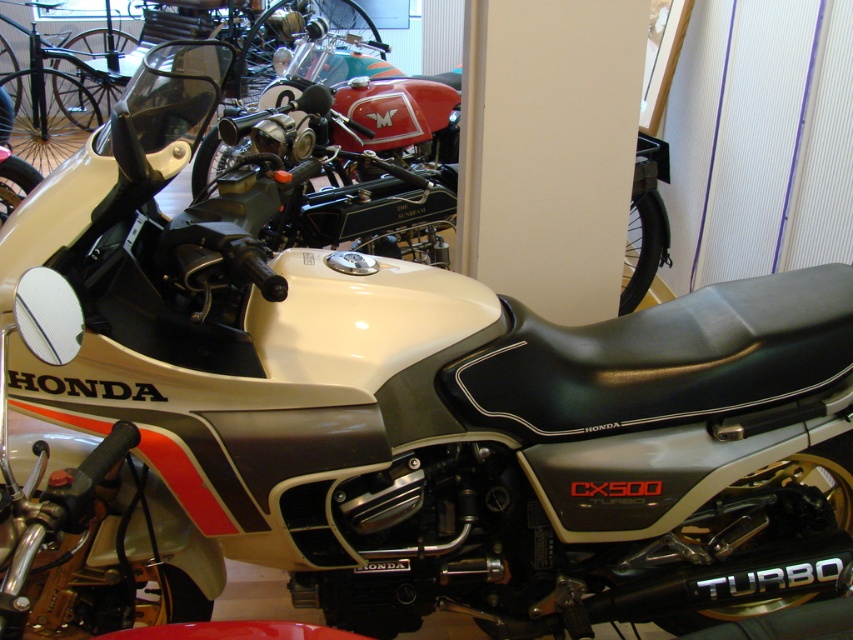
Does point (561, 177) come farther from viewer compared to point (407, 212)?

No, it is in front of (407, 212).

Who is lower down, white matte pillar at center or matte black motorcycle at center?

white matte pillar at center is below.

Find the location of a particular element. This screenshot has height=640, width=853. white matte pillar at center is located at coordinates (549, 148).

Identify the location of white matte pillar at center. (549, 148).